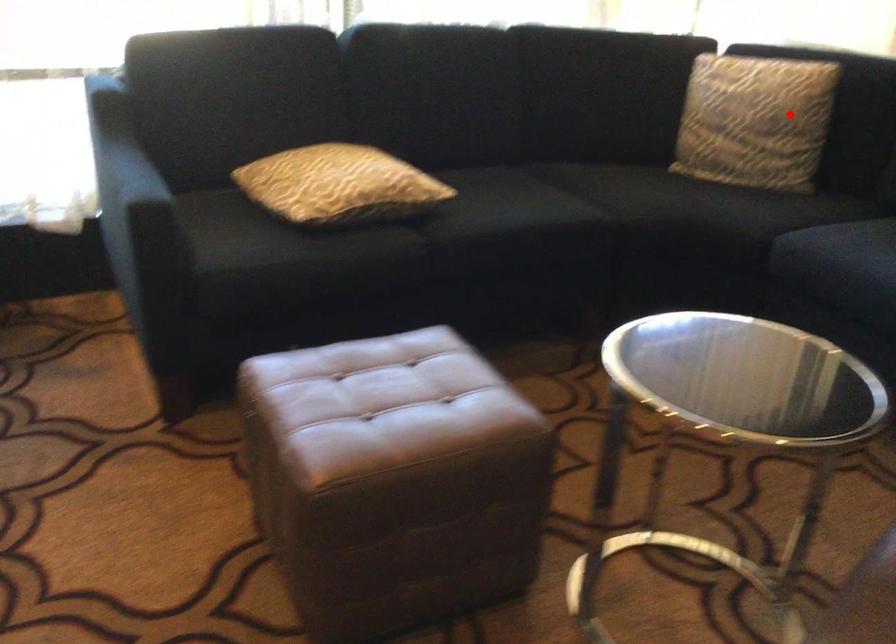
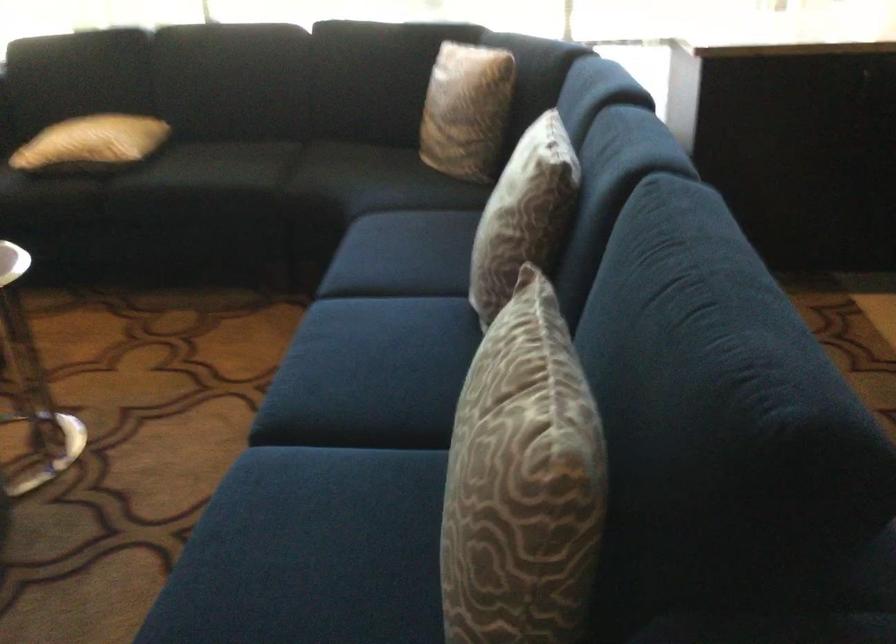
In the second image, find the point that corresponds to the highlighted location in the first image.

(467, 109)